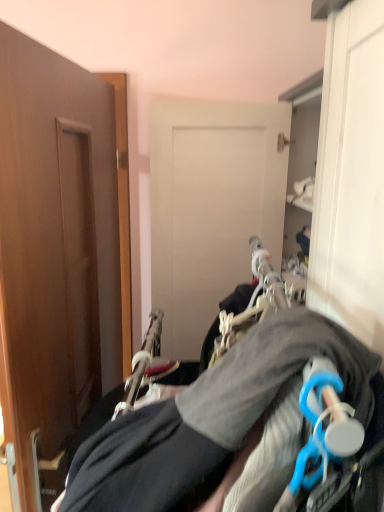
Question: Can we say gray fabric hanger at center lies outside brown wood door at left?

Choices:
 (A) yes
 (B) no

Answer: (A)

Question: Considering the relative sizes of gray fabric hanger at center and brown wood door at left in the image provided, is gray fabric hanger at center smaller than brown wood door at left?

Choices:
 (A) yes
 (B) no

Answer: (B)

Question: From a real-world perspective, is gray fabric hanger at center below brown wood door at left?

Choices:
 (A) yes
 (B) no

Answer: (A)

Question: Is gray fabric hanger at center beside brown wood door at left?

Choices:
 (A) yes
 (B) no

Answer: (B)

Question: Is gray fabric hanger at center in front of brown wood door at left?

Choices:
 (A) no
 (B) yes

Answer: (B)

Question: Is gray fabric hanger at center thinner than brown wood door at left?

Choices:
 (A) no
 (B) yes

Answer: (A)

Question: From a real-world perspective, does brown wood door at left sit lower than gray fabric hanger at center?

Choices:
 (A) no
 (B) yes

Answer: (A)

Question: Considering the relative sizes of brown wood door at left and gray fabric hanger at center in the image provided, is brown wood door at left shorter than gray fabric hanger at center?

Choices:
 (A) no
 (B) yes

Answer: (A)

Question: From a real-world perspective, is brown wood door at left located higher than gray fabric hanger at center?

Choices:
 (A) yes
 (B) no

Answer: (A)

Question: Is gray fabric hanger at center at the back of brown wood door at left?

Choices:
 (A) no
 (B) yes

Answer: (B)

Question: Does brown wood door at left have a lesser width compared to gray fabric hanger at center?

Choices:
 (A) yes
 (B) no

Answer: (A)

Question: From the image's perspective, is brown wood door at left on gray fabric hanger at center?

Choices:
 (A) yes
 (B) no

Answer: (A)

Question: In terms of height, does brown wood door at left look taller or shorter compared to gray fabric hanger at center?

Choices:
 (A) tall
 (B) short

Answer: (A)